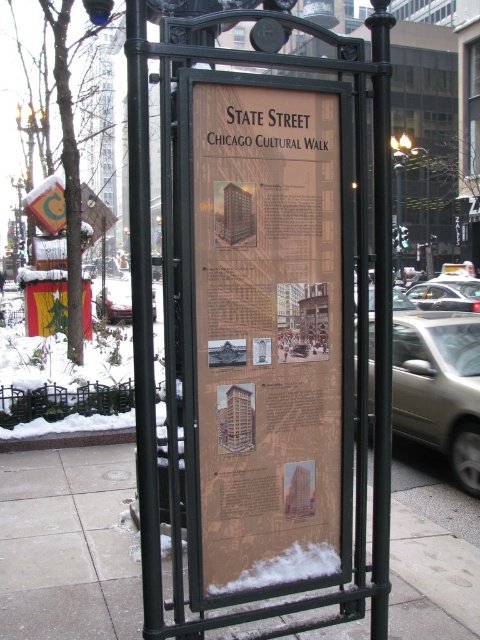
Does matte silver sedan at right have a greater width compared to polished brass lamp post at upper right?

No.

Is point (462, 342) behind point (397, 221)?

No, (462, 342) is in front of (397, 221).

At what (x,y) coordinates should I click in order to perform the action: click on matte silver sedan at right. Please return your answer as a coordinate pair (x, y). The image size is (480, 640). Looking at the image, I should click on (439, 387).

Does point (199, 360) come closer to viewer compared to point (425, 294)?

That is True.

Is wooden signboard at center above yellow rubber taxi at center right?

Incorrect, wooden signboard at center is not positioned above yellow rubber taxi at center right.

This screenshot has height=640, width=480. What are the coordinates of `wooden signboard at center` in the screenshot? It's located at (267, 332).

Is matte brown sign at center to the right of metallic pole at upper center from the viewer's perspective?

In fact, matte brown sign at center is to the left of metallic pole at upper center.

Is point (285, 58) farther from viewer compared to point (420, 148)?

No, (285, 58) is closer to viewer.

Which is behind, point (249, 500) or point (427, 186)?

Positioned behind is point (427, 186).

Identify the location of matte brown sign at center. The height and width of the screenshot is (640, 480). (260, 314).